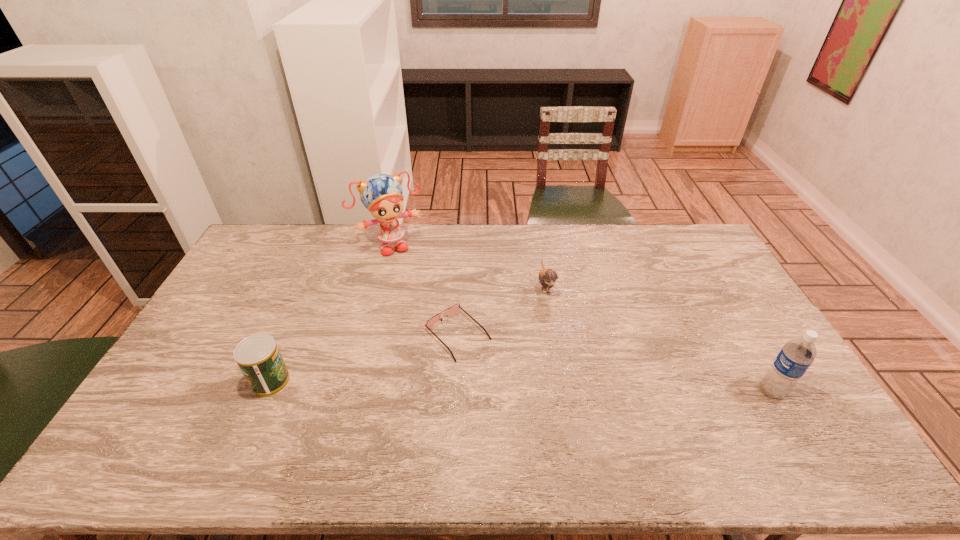
Find the location of a particular element. The height and width of the screenshot is (540, 960). vacant region located on the front-facing side of the kitten is located at coordinates (584, 401).

Find the location of a particular element. object located at the far edge is located at coordinates (381, 194).

Locate an element on the screen. This screenshot has width=960, height=540. object present at the near edge is located at coordinates (796, 356).

Image resolution: width=960 pixels, height=540 pixels. Find the location of `object that is positioned at the right edge`. object that is positioned at the right edge is located at coordinates (796, 356).

Identify the location of object present at the near right corner. This screenshot has width=960, height=540. (796, 356).

Find the location of a particular element. Image resolution: width=960 pixels, height=540 pixels. vacant space at the far edge of the desktop is located at coordinates click(x=324, y=228).

This screenshot has height=540, width=960. Find the location of `vacant space at the left edge`. vacant space at the left edge is located at coordinates click(x=245, y=303).

Find the location of `vacant space at the right edge`. vacant space at the right edge is located at coordinates (756, 337).

This screenshot has width=960, height=540. Identify the location of vacant space at the far right corner. click(x=687, y=248).

This screenshot has width=960, height=540. In order to click on empty space that is in between the third shortest object and the third object from left to right in this screenshot , I will do `click(364, 358)`.